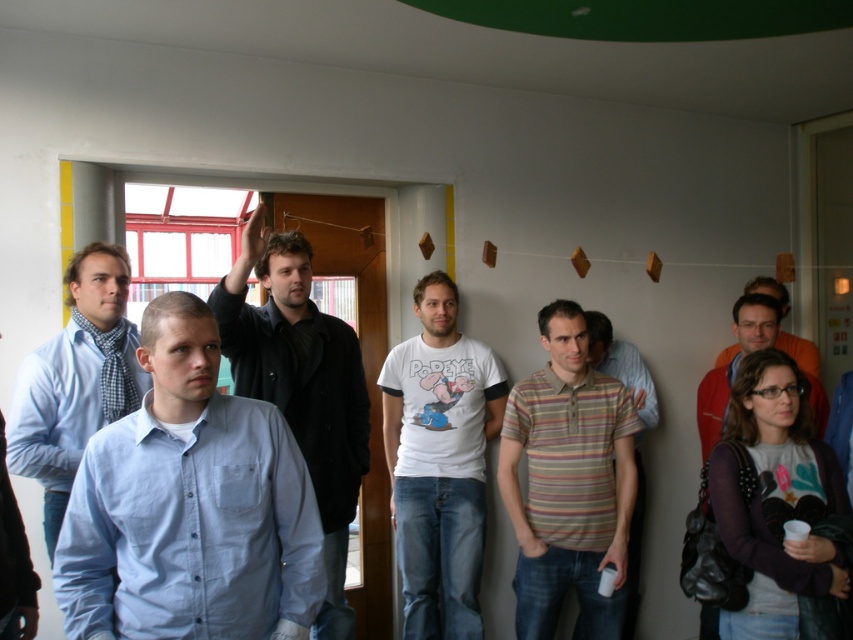
You are standing at a distance of 3 meters from the camera. Can you reach the point marked at coordinates point [717,410] without moving closer?

The point marked at coordinates point [717,410] is 3.44 meters away from the camera. Since you are standing at 3 meters from the camera, you are 0.44 meters away from the point and can reach it without moving closer.